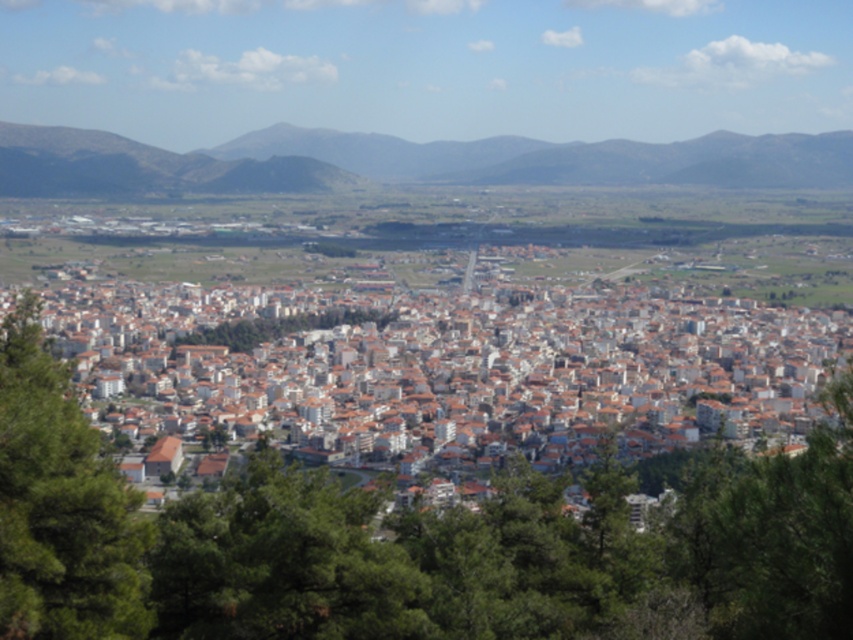
You are a city planner assessing the urban layout. You need to determine if there is enough space between the white matte building at center and the green leafy tree at lower left to install a new pedestrian walkway that requires a minimum width of 10 meters. Can you confirm if the space between them allows for this?

The white matte building at center might be wider than green leafy tree at lower left, so the space between them may or may not be sufficient for a 10 meter walkway. Further measurement is needed to confirm.

You are a city planner reviewing this urban layout. The white matte building at center needs to be expanded. Considering the dark brown rocky hillside at upper center, which direction should the building be extended to avoid encroaching on the hillside?

The white matte building at center is located below the dark brown rocky hillside at upper center, so expanding it downward or to the sides away from the hillside would prevent encroachment.